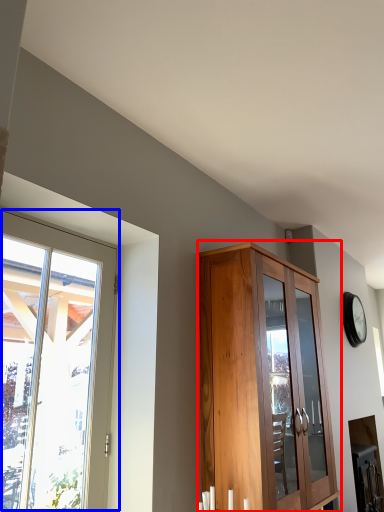
Question: Which of the following is the farthest to the observer, cupboard (highlighted by a red box) or window (highlighted by a blue box)?

Choices:
 (A) cupboard
 (B) window

Answer: (A)